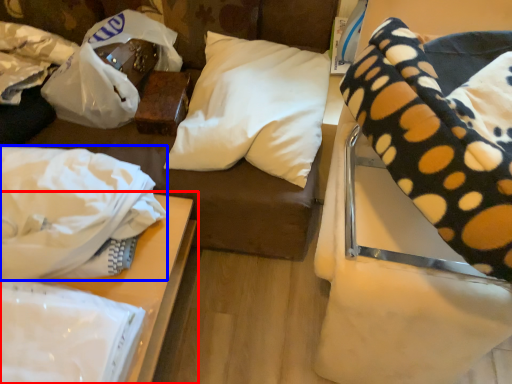
Question: Among these objects, which one is nearest to the camera, table (highlighted by a red box) or material (highlighted by a blue box)?

Choices:
 (A) table
 (B) material

Answer: (B)